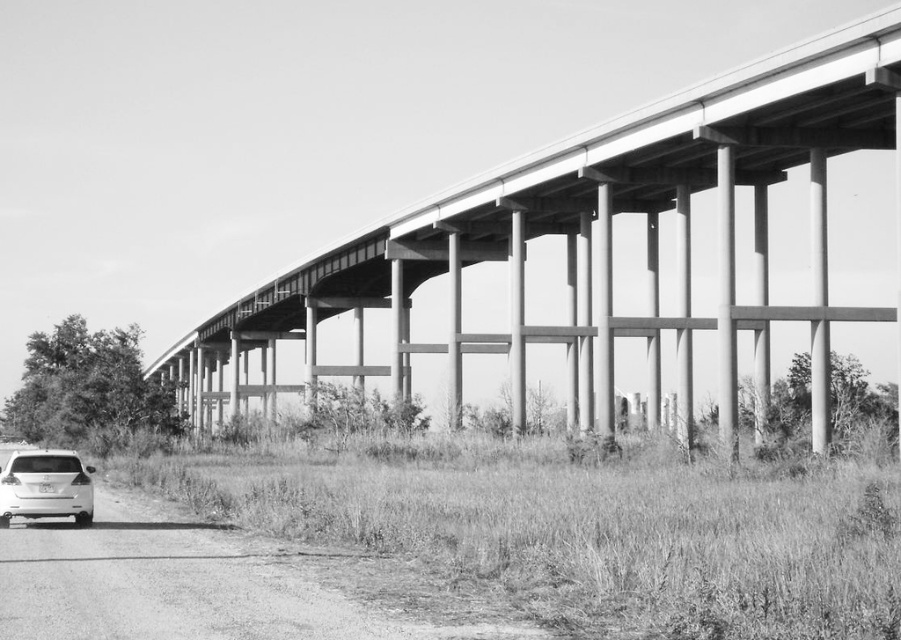
You are a photographer standing at the base of the concrete bridge at center. You want to take a photo of the white matte car at lower left parked on the dirt road. Considering the height of the bridge and the car, will the bridge block your view of the car?

The concrete bridge at center is taller than the white matte car at lower left, so the bridge will block your view of the car.

You are a delivery driver who needs to turn around your white matte car at lower left. The concrete bridge at center has a narrow section. Can you safely turn your car without hitting the bridge pillars?

The concrete bridge at center might be wider than white matte car at lower left, but the description does not specify the exact width of the narrow section. It is uncertain if the turn can be made safely without hitting the pillars.